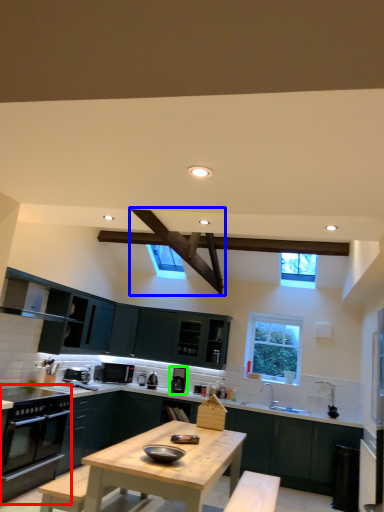
Question: Which object is the closest to the kitchen appliance (highlighted by a red box)? Choose among these: exhaust hood (highlighted by a blue box) or appliance (highlighted by a green box).

Choices:
 (A) exhaust hood
 (B) appliance

Answer: (A)